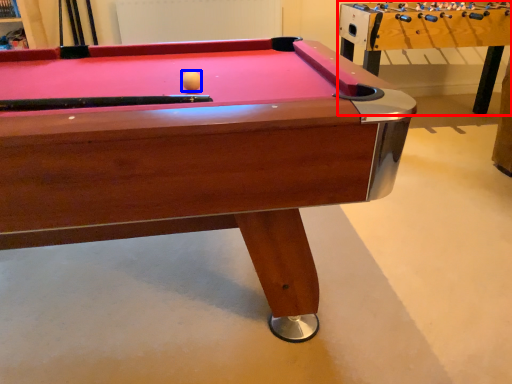
Question: Among these objects, which one is nearest to the camera, table (highlighted by a red box) or ball (highlighted by a blue box)?

Choices:
 (A) table
 (B) ball

Answer: (B)